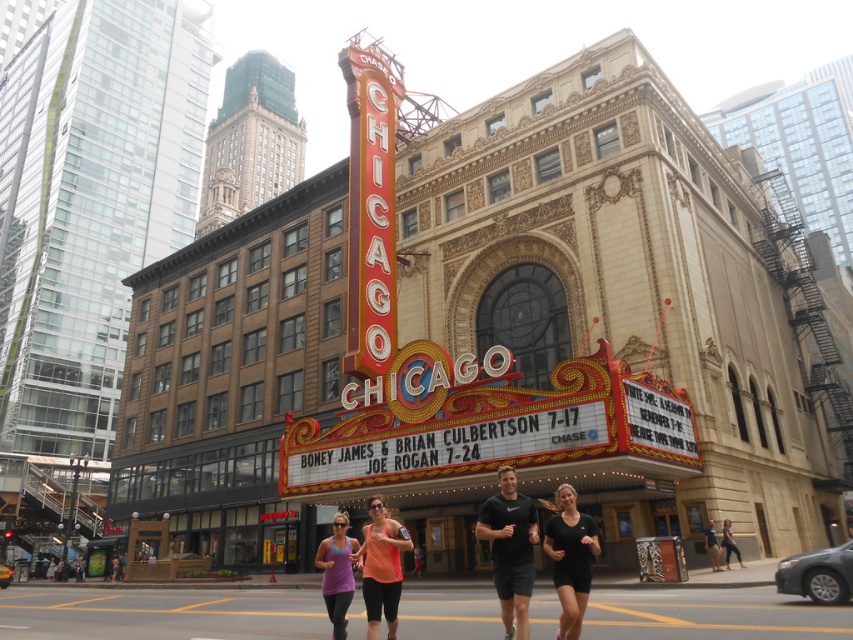
You are a photographer standing in front of the Chicago Theater. You notice a person wearing black matte shorts at lower right and another wearing a matte orange shirt at center. Which clothing item appears narrower in the photo?

The black matte shorts at lower right appears narrower than the matte orange shirt at center as per the description.

You are a photographer trying to capture a candid shot of the matte orange shirt at center and the purple fabric tank top at lower center in the busy Chicago Theater area. Since you want to ensure both are in focus, you need to know their relative sizes. Which of the two is smaller?

The matte orange shirt at center is smaller compared to the purple fabric tank top at lower center.

What are the coordinates of the black matte shirt at center?

The black matte shirt at center is located at coordinates point (509,548).